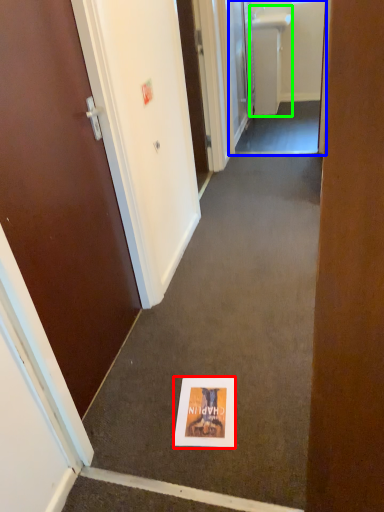
Question: Which object is positioned closest to flyer (highlighted by a red box)? Select from passage (highlighted by a blue box) and sink (highlighted by a green box).

Choices:
 (A) passage
 (B) sink

Answer: (A)